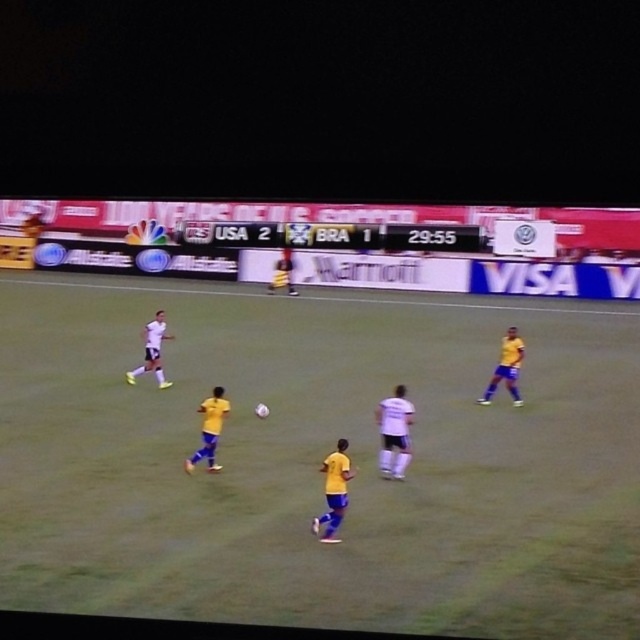
You are a soccer coach observing the match. You notice the white matte soccer player at left and the yellow jersey at center. Which player appears to be closer to the camera based on their size?

The white matte soccer player at left has a smaller size compared to the yellow jersey at center, so the yellow jersey at center is closer to the camera.

You are a spectator at the soccer match and want to take a photo of both the yellow matte soccer player at center and the white matte soccer player at left. Based on their positions, which player is positioned more to the right side of the field?

The yellow matte soccer player at center is positioned more to the right side of the field compared to the white matte soccer player at left.

You are a soccer coach watching the match. You notice the yellow matte jersey at right and the white matte soccer player at left. Which player is positioned closer to the ground?

The yellow matte jersey at right is below the white matte soccer player at left, so the yellow matte jersey at right is closer to the ground.